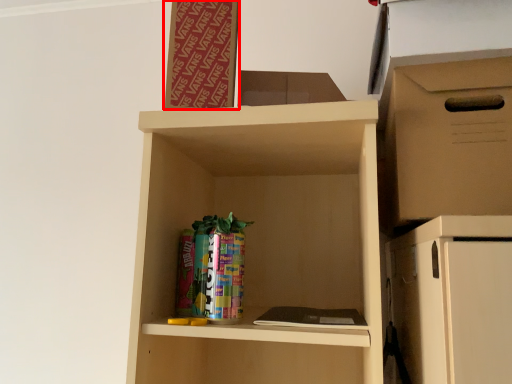
Question: From the image's perspective, considering the relative positions of bulletin board (annotated by the red box) and storage box in the image provided, where is bulletin board (annotated by the red box) located with respect to the staircase?

Choices:
 (A) below
 (B) above

Answer: (B)